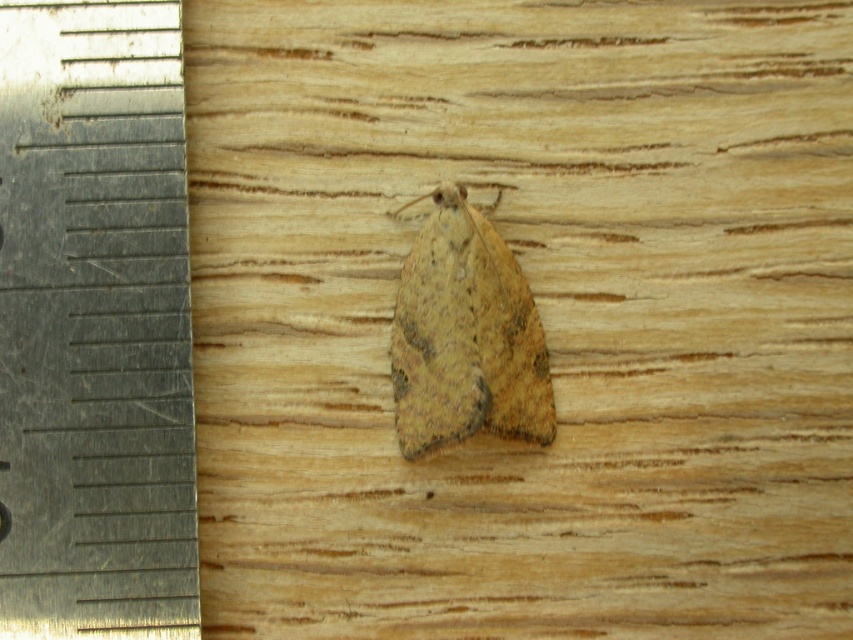
Is metallic silver ruler at left below brown textured moth at center?

No, metallic silver ruler at left is not below brown textured moth at center.

Who is more forward, (16, 275) or (415, 442)?

Positioned in front is point (16, 275).

Who is more distant from viewer, (160,72) or (413,298)?

Point (413,298)

In order to click on metallic silver ruler at left in this screenshot , I will do `click(94, 324)`.